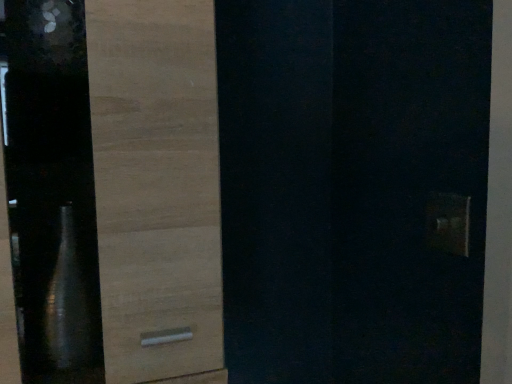
At what (x,y) coordinates should I click in order to perform the action: click on wooden drawer at left. Please return your answer as a coordinate pair (x, y). The image size is (512, 384). Looking at the image, I should click on (157, 188).

What do you see at coordinates (157, 188) in the screenshot? The image size is (512, 384). I see `wooden drawer at left` at bounding box center [157, 188].

Locate an element on the screen. wooden drawer at left is located at coordinates (x=157, y=188).